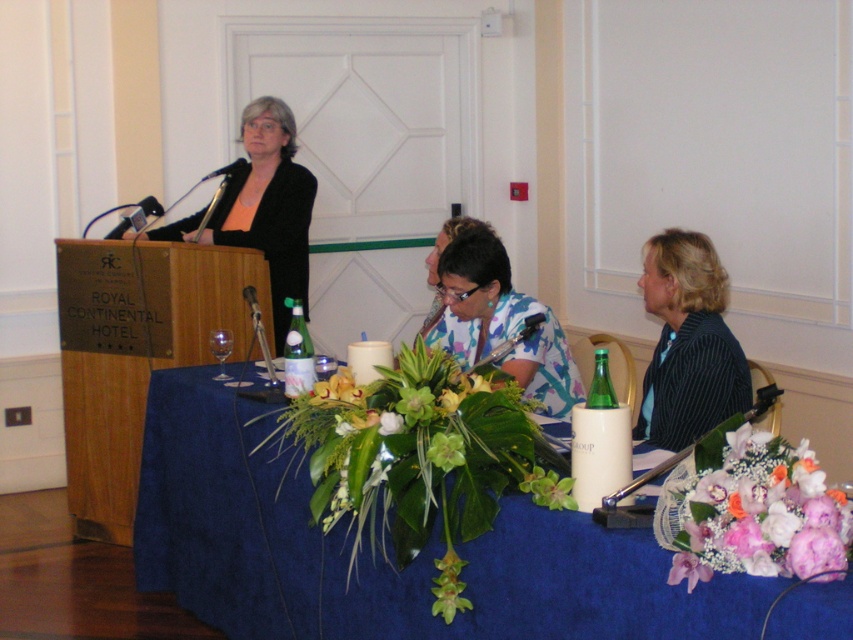
Based on the photo, you are an event planner standing at the front of the room. You need to place a name tag for the keynote speaker. The name tag must be placed exactly at the coordinates where the purple silk flowers at center are located. What are the coordinates where you should place the name tag?

The purple silk flowers at center are located at coordinates point (x=756, y=513), so you should place the name tag at point (x=756, y=513).

You are an event planner arranging the table for a formal dinner. You have the purple silk flowers at center and the floral print shirt at center. According to the scene, which item should be placed to the right of the other?

The purple silk flowers at center should be placed to the right of the floral print shirt at center because the description states that the purple silk flowers are positioned on the right side of the floral print shirt.

You are an event planner setting up the venue for a presentation. You need to place a new decorative item on the table. The item requires a clear space of 20 cm in diameter. Can you place it on the blue fabric table at center without overlapping the green leafy plant at center?

The blue fabric table at center is below the green leafy plant at center, so there is space available on the table to place the decorative item without overlapping the plant.